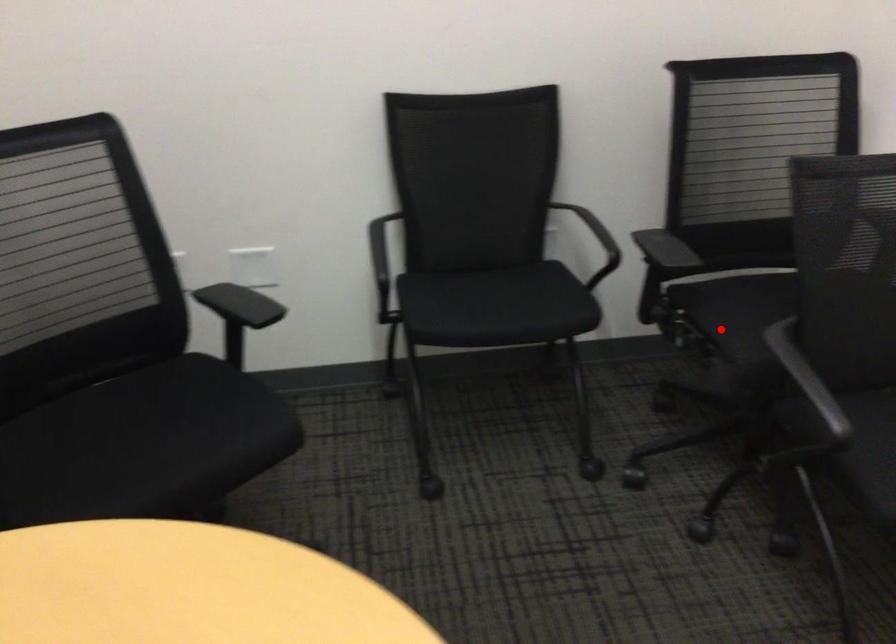
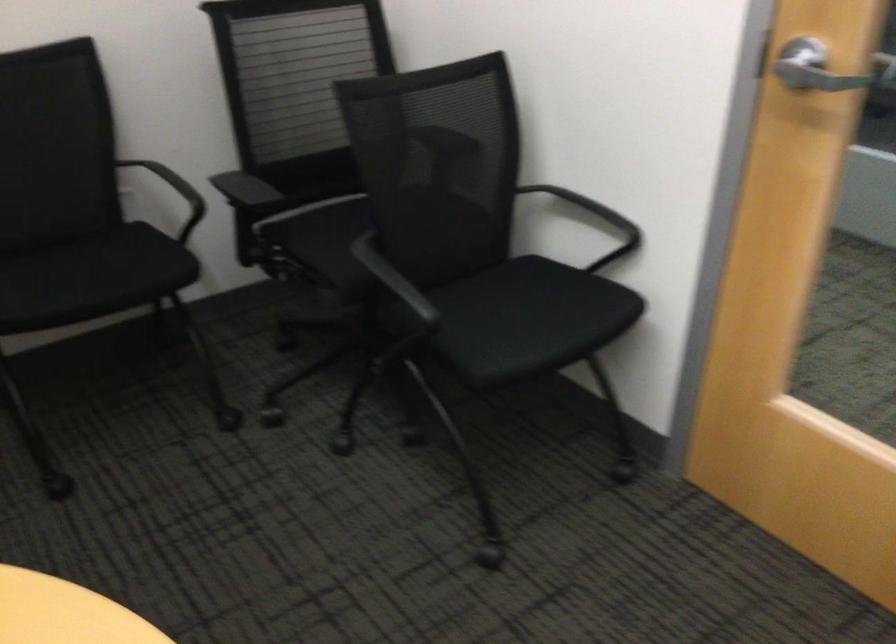
Where in the second image is the point corresponding to the highlighted location from the first image?

(321, 254)